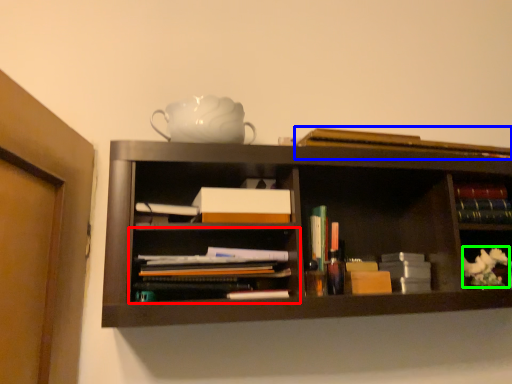
Question: Which object is the farthest from shelf (highlighted by a red box)? Choose among these: book (highlighted by a blue box) or flower (highlighted by a green box).

Choices:
 (A) book
 (B) flower

Answer: (B)